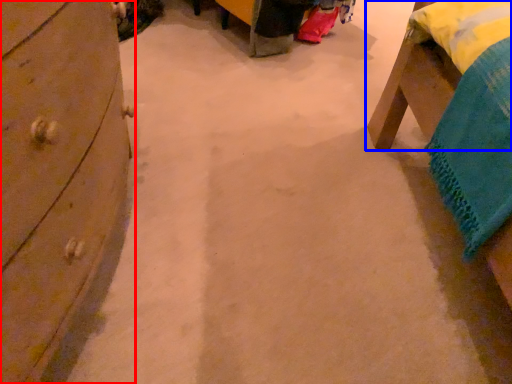
Question: Among these objects, which one is farthest to the camera, chest of drawers (highlighted by a red box) or furniture (highlighted by a blue box)?

Choices:
 (A) chest of drawers
 (B) furniture

Answer: (B)